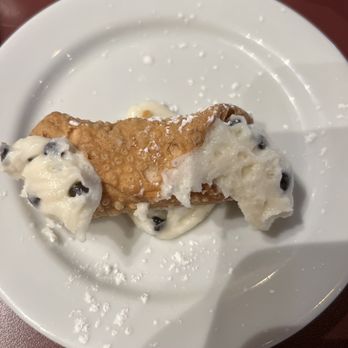
Locate an element on the screen. The image size is (348, 348). plate is located at coordinates (167, 51).